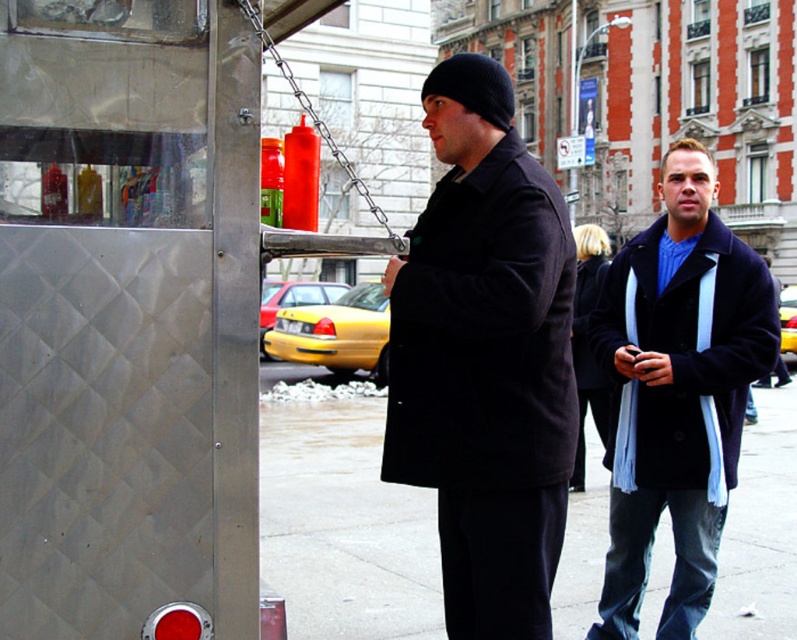
You are a pedestrian trying to cross the street in front of the yellow matte taxi at center and the dark blue wool coat at right. Which object is closer to the curb?

The dark blue wool coat at right is positioned on the right side of the yellow matte taxi at center, so the yellow matte taxi at center is closer to the curb than the dark blue wool coat at right.